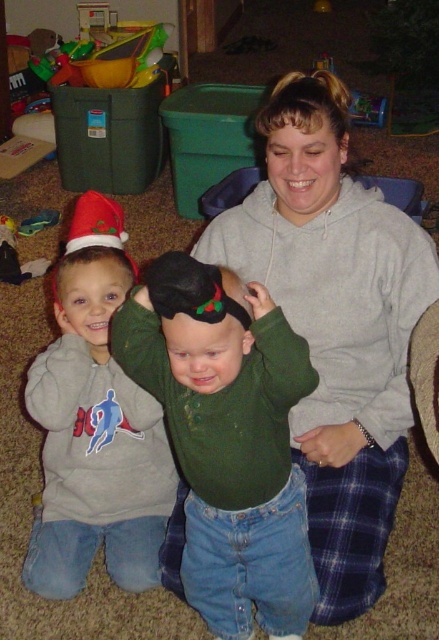
Is point (194, 385) closer to camera compared to point (58, 470)?

Yes, point (194, 385) is closer to viewer.

Who is taller, matte green sweater at center or matte gray hoodie at left?

With more height is matte green sweater at center.

Who is more forward, (291, 582) or (47, 428)?

Point (291, 582) is in front.

The width and height of the screenshot is (439, 640). In order to click on matte green sweater at center in this screenshot , I will do `click(227, 438)`.

Who is more distant from viewer, (x=421, y=269) or (x=53, y=401)?

Point (x=53, y=401)

Does green matte sweater at center have a smaller size compared to matte gray hoodie at left?

Incorrect, green matte sweater at center is not smaller in size than matte gray hoodie at left.

Is point (330, 211) closer to camera compared to point (151, 538)?

That is True.

You are a GUI agent. You are given a task and a screenshot of the screen. Output one action in this format:
    pyautogui.click(x=<x>, y=<y>)
    Task: Click on the green matte sweater at center
    
    Given the screenshot: What is the action you would take?
    pyautogui.click(x=334, y=324)

Which of these two, green matte sweater at center or matte green sweater at center, stands shorter?

matte green sweater at center

At what (x,y) coordinates should I click in order to perform the action: click on green matte sweater at center. Please return your answer as a coordinate pair (x, y). The height and width of the screenshot is (640, 439). Looking at the image, I should click on (334, 324).

Between point (381, 456) and point (215, 438), which one is positioned behind?

Positioned behind is point (381, 456).

Image resolution: width=439 pixels, height=640 pixels. What are the coordinates of `green matte sweater at center` in the screenshot? It's located at (334, 324).